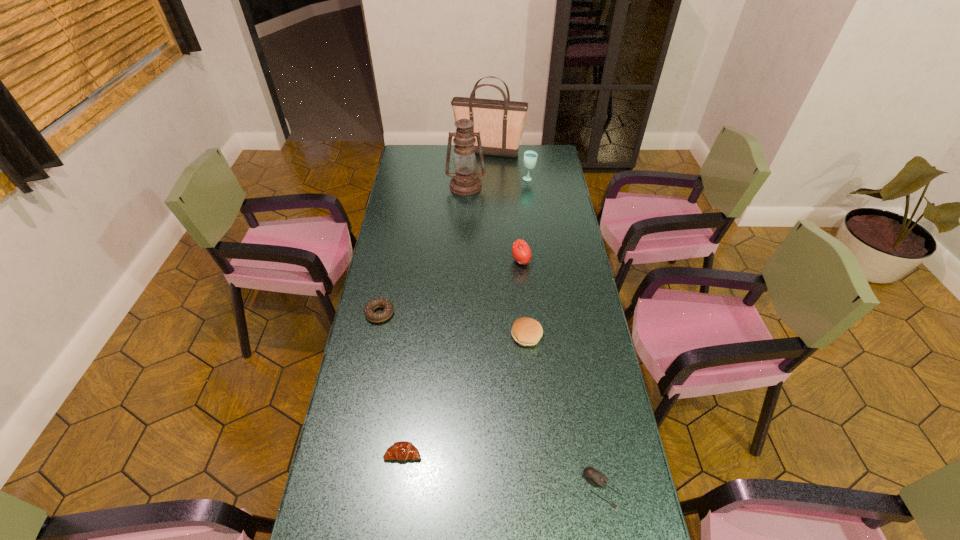
At what (x,y) coordinates should I click in order to perform the action: click on crescent roll located in the left edge section of the desktop. Please return your answer as a coordinate pair (x, y). The image size is (960, 540). Looking at the image, I should click on (402, 450).

This screenshot has width=960, height=540. Identify the location of glass situated at the right edge. (530, 157).

The height and width of the screenshot is (540, 960). Find the location of `mouse located in the right edge section of the desktop`. mouse located in the right edge section of the desktop is located at coordinates (594, 477).

Find the location of a particular element. This screenshot has height=540, width=960. vacant space at the left edge of the desktop is located at coordinates [320, 531].

This screenshot has height=540, width=960. Find the location of `vacant space at the right edge of the desktop`. vacant space at the right edge of the desktop is located at coordinates (625, 449).

I want to click on vacant space in between the farthest object and the seventh farthest object, so click(446, 303).

Identify the location of vacant area between the glass and the shopping bag. This screenshot has width=960, height=540. (509, 166).

Find the location of a particular element. unoccupied area between the apple and the leftmost object is located at coordinates (450, 287).

Where is `empty space that is in between the oil lamp and the third tallest object`? Image resolution: width=960 pixels, height=540 pixels. empty space that is in between the oil lamp and the third tallest object is located at coordinates (497, 183).

Identify the location of vacant region between the doughnut and the glass. (454, 246).